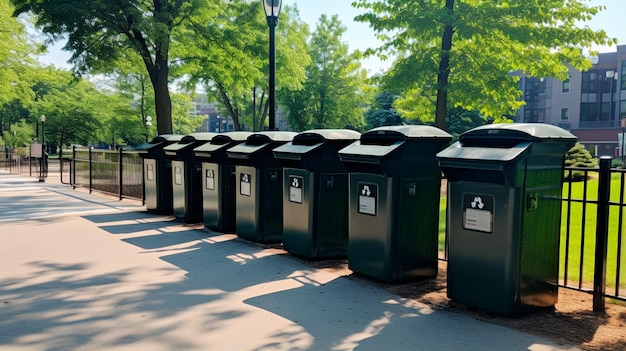
Identify the location of trash cans. (149, 182), (175, 189), (208, 205), (245, 209), (293, 219), (362, 229), (493, 250).